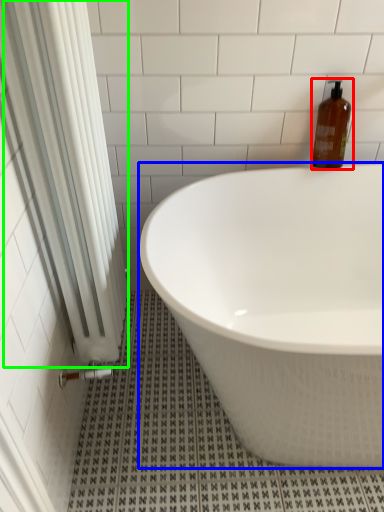
Question: Which is farther away from bottle (highlighted by a red box)? bathtub (highlighted by a blue box) or shower curtain (highlighted by a green box)?

Choices:
 (A) bathtub
 (B) shower curtain

Answer: (B)